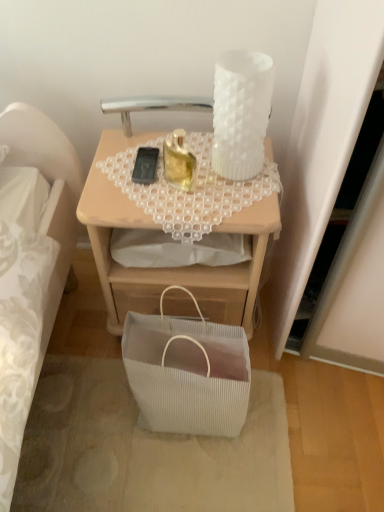
Identify the location of free area in between white frosted glass candle holder at upper right, the 2th candle holder from the left, and translucent glass candle at upper center, arranged as the second candle holder when viewed from the right. (214, 173).